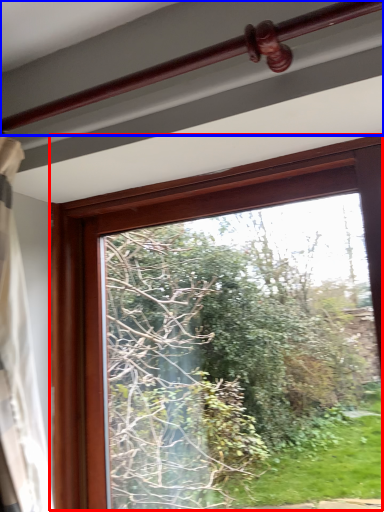
Question: Which of the following is the closest to the observer, window (highlighted by a red box) or rail (highlighted by a blue box)?

Choices:
 (A) window
 (B) rail

Answer: (B)